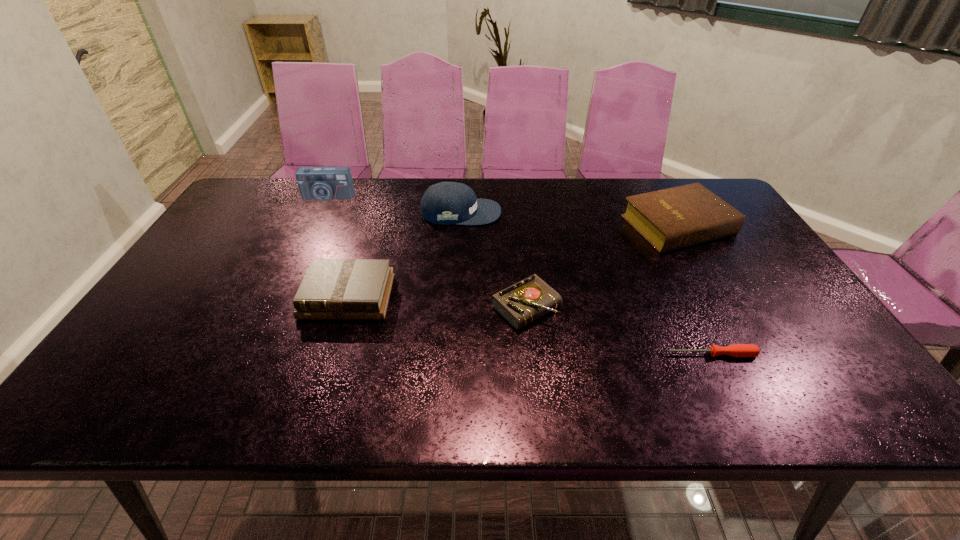
Where is `empty space that is in between the camera and the farther Bible`? The width and height of the screenshot is (960, 540). empty space that is in between the camera and the farther Bible is located at coordinates (503, 211).

Locate an element on the screen. This screenshot has width=960, height=540. empty location between the right Bible and the diary is located at coordinates (602, 266).

The height and width of the screenshot is (540, 960). Identify the location of free area in between the camera and the diary. (427, 252).

Find the location of a particular element. free space between the baseball cap and the right Bible is located at coordinates (569, 219).

I want to click on free space between the camera and the right Bible, so click(x=503, y=211).

In order to click on free space between the farther Bible and the nearer Bible in this screenshot , I will do `click(513, 261)`.

Identify which object is the nearest to the farther Bible. Please provide its 2D coordinates. Your answer should be formatted as a tuple, i.e. [(x, y)], where the tuple contains the x and y coordinates of a point satisfying the conditions above.

[(524, 302)]

Locate an element on the screen. The height and width of the screenshot is (540, 960). object that is the nearest to the camera is located at coordinates (445, 203).

Identify the location of vacant area in the image that satisfies the following two spatial constraints: 1. on the front-facing side of the baseball cap; 2. on the spine side of the left Bible. (456, 296).